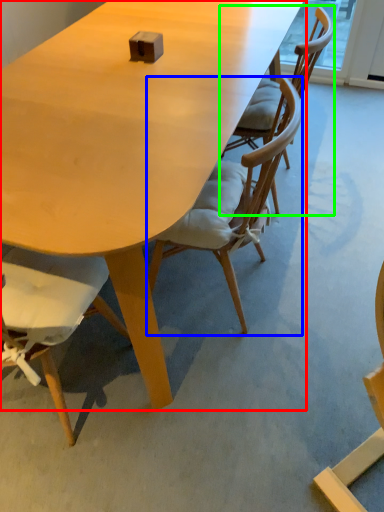
Question: Considering the real-world distances, which object is closest to table (highlighted by a red box)? chair (highlighted by a blue box) or chair (highlighted by a green box).

Choices:
 (A) chair
 (B) chair

Answer: (A)